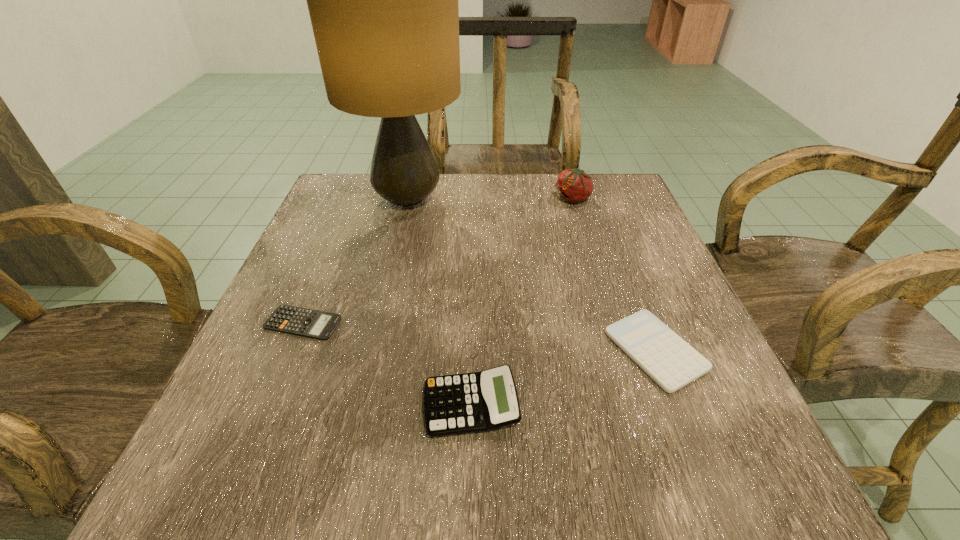
Identify the location of the tallest object. Image resolution: width=960 pixels, height=540 pixels. (383, 0).

The height and width of the screenshot is (540, 960). What are the coordinates of `the second tallest object` in the screenshot? It's located at (574, 185).

At what (x,y) coordinates should I click in order to perform the action: click on the tallest calculator. Please return your answer as a coordinate pair (x, y). The height and width of the screenshot is (540, 960). Looking at the image, I should click on pos(481,401).

This screenshot has height=540, width=960. In order to click on the third tallest object in this screenshot , I will do `click(481, 401)`.

Identify the location of the second shortest object. (665, 357).

In order to click on the rightmost calculator in this screenshot , I will do `click(665, 357)`.

Where is `the leftmost calculator`? The width and height of the screenshot is (960, 540). the leftmost calculator is located at coordinates (294, 320).

The height and width of the screenshot is (540, 960). What are the coordinates of `the shortest calculator` in the screenshot? It's located at (294, 320).

I want to click on vacant space positioned 0.070m on the front of the lampshade, so click(396, 252).

Locate an element on the screen. This screenshot has width=960, height=540. free location located on the left of the tomato is located at coordinates (455, 198).